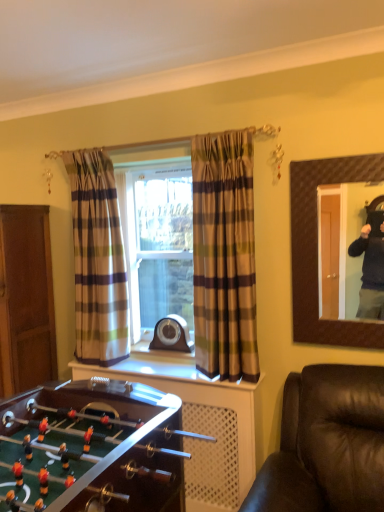
Consider the image. Measure the distance between brown wooden dresser at lower left and camera.

They are 2.23 meters apart.

Identify the location of plaid fabric curtain at left, marked as the first curtain in a left-to-right arrangement. (97, 260).

Locate an element on the screen. The width and height of the screenshot is (384, 512). brown textured mirror at upper right is located at coordinates (317, 249).

Is brown textured mirror at upper right turned away from brown wooden dresser at lower left?

That's not correct — brown textured mirror at upper right is not looking away from brown wooden dresser at lower left.

At what (x,y) coordinates should I click in order to perform the action: click on mirror located above the brown wooden dresser at lower left (from the image's perspective). Please return your answer as a coordinate pair (x, y). Looking at the image, I should click on (317, 249).

Are brown textured mirror at upper right and brown wooden dresser at lower left making contact?

brown textured mirror at upper right and brown wooden dresser at lower left are clearly separated.

Between point (311, 240) and point (195, 426), which one is positioned behind?

Positioned behind is point (195, 426).

Considering the sizes of objects plaid fabric curtain at left, acting as the 1th curtain starting from the back, and brown plaid curtain at center, the first curtain when ordered from front to back, in the image provided, who is smaller, plaid fabric curtain at left, acting as the 1th curtain starting from the back, or brown plaid curtain at center, the first curtain when ordered from front to back,?

With smaller size is brown plaid curtain at center, the first curtain when ordered from front to back.

Which is more to the right, plaid fabric curtain at left, acting as the 2th curtain starting from the right, or brown plaid curtain at center, which appears as the second curtain when viewed from the left?

Positioned to the right is brown plaid curtain at center, which appears as the second curtain when viewed from the left.

Is plaid fabric curtain at left, which is the 2th curtain from front to back, turned away from brown plaid curtain at center, which appears as the second curtain when viewed from the left?

plaid fabric curtain at left, which is the 2th curtain from front to back, is not turned away from brown plaid curtain at center, which appears as the second curtain when viewed from the left.

From the image's perspective, is plaid fabric curtain at left, which is the 2th curtain from front to back, located above or below brown plaid curtain at center, which appears as the second curtain when viewed from the left?

plaid fabric curtain at left, which is the 2th curtain from front to back, is above brown plaid curtain at center, which appears as the second curtain when viewed from the left.

Consider the image. Is brown wooden door at left positioned beyond the bounds of brown wooden dresser at lower left?

brown wooden door at left is positioned outside brown wooden dresser at lower left.

Considering the sizes of brown wooden door at left and brown wooden dresser at lower left in the image, is brown wooden door at left bigger or smaller than brown wooden dresser at lower left?

In the image, brown wooden door at left appears to be smaller than brown wooden dresser at lower left.

Identify the location of dresser that is below the brown wooden door at left (from the image's perspective). The image size is (384, 512). (202, 423).

Which of these two, brown wooden door at left or brown wooden dresser at lower left, stands shorter?

Standing shorter between the two is brown wooden dresser at lower left.

Does point (291, 222) come farther from viewer compared to point (15, 391)?

No, it is in front of (15, 391).

From the picture: Is brown textured mirror at upper right turned away from brown wooden door at left?

No, brown textured mirror at upper right is not facing the opposite direction of brown wooden door at left.

Are brown textured mirror at upper right and brown wooden door at left far apart?

brown textured mirror at upper right is far away from brown wooden door at left.

Can we say brown textured mirror at upper right lies outside brown wooden door at left?

brown textured mirror at upper right lies outside brown wooden door at left's area.

Who is more distant, brown wooden door at left or brown plaid curtain at center, acting as the 1th curtain starting from the right?

brown wooden door at left is more distant.

Where is `the 2nd curtain in front of the brown wooden door at left, starting your count from the anchor`? The width and height of the screenshot is (384, 512). the 2nd curtain in front of the brown wooden door at left, starting your count from the anchor is located at coordinates (224, 256).

Consider the image. From the image's perspective, which is below, brown wooden door at left or brown plaid curtain at center, acting as the 1th curtain starting from the right?

brown wooden door at left.

Visually, is brown wooden door at left positioned to the left or to the right of brown plaid curtain at center, acting as the 1th curtain starting from the right?

brown wooden door at left is to the left of brown plaid curtain at center, acting as the 1th curtain starting from the right.

From the image's perspective, which is above, brown wooden dresser at lower left or brown textured mirror at upper right?

brown textured mirror at upper right appears higher in the image.

Is brown wooden dresser at lower left positioned with its back to brown textured mirror at upper right?

That's not correct — brown wooden dresser at lower left is not looking away from brown textured mirror at upper right.

Considering the positions of objects brown wooden dresser at lower left and brown textured mirror at upper right in the image provided, who is more to the left, brown wooden dresser at lower left or brown textured mirror at upper right?

Positioned to the left is brown wooden dresser at lower left.

Which of these two, brown wooden dresser at lower left or brown textured mirror at upper right, is bigger?

Bigger between the two is brown wooden dresser at lower left.

From a real-world perspective, which object rests below the other?

From a 3D spatial view, brown plaid curtain at center, which appears as the second curtain when viewed from the left, is below.

Can you see brown plaid curtain at center, which appears as the second curtain when viewed from the left, touching brown textured mirror at upper right?

No, brown plaid curtain at center, which appears as the second curtain when viewed from the left, is not beside brown textured mirror at upper right.

Considering the relative positions of brown plaid curtain at center, the first curtain when ordered from front to back, and brown textured mirror at upper right in the image provided, is brown plaid curtain at center, the first curtain when ordered from front to back, behind brown textured mirror at upper right?

Yes, brown plaid curtain at center, the first curtain when ordered from front to back, is further from the viewer.

Where is `dresser that is under the brown textured mirror at upper right (from a real-world perspective)`? dresser that is under the brown textured mirror at upper right (from a real-world perspective) is located at coordinates (202, 423).

Where is `curtain lying below the plaid fabric curtain at left, acting as the 1th curtain starting from the back (from the image's perspective)`? curtain lying below the plaid fabric curtain at left, acting as the 1th curtain starting from the back (from the image's perspective) is located at coordinates (224, 256).

Based on the photo, when comparing their distances from brown textured mirror at upper right, does brown wooden dresser at lower left or brown wooden door at left seem further?

brown wooden door at left is further to brown textured mirror at upper right.

From the image, which object appears to be farther from brown textured mirror at upper right, brown wooden dresser at lower left or plaid fabric curtain at left, acting as the 1th curtain starting from the back?

plaid fabric curtain at left, acting as the 1th curtain starting from the back.

Which object lies nearer to the anchor point brown plaid curtain at center, the 2th curtain positioned from the back, brown textured mirror at upper right or plaid fabric curtain at left, acting as the 1th curtain starting from the back?

brown textured mirror at upper right lies closer to brown plaid curtain at center, the 2th curtain positioned from the back, than the other object.

Looking at the image, which one is located further to brown wooden door at left, brown textured mirror at upper right or brown wooden dresser at lower left?

brown textured mirror at upper right is further to brown wooden door at left.

Looking at the image, which one is located closer to brown textured mirror at upper right, brown wooden door at left or brown plaid curtain at center, which appears as the second curtain when viewed from the left?

The object closer to brown textured mirror at upper right is brown plaid curtain at center, which appears as the second curtain when viewed from the left.

Which object lies nearer to the anchor point brown wooden door at left, brown plaid curtain at center, acting as the 1th curtain starting from the right, or brown textured mirror at upper right?

brown plaid curtain at center, acting as the 1th curtain starting from the right, lies closer to brown wooden door at left than the other object.

Considering their positions, is brown textured mirror at upper right positioned further to plaid fabric curtain at left, acting as the 2th curtain starting from the right, than brown wooden dresser at lower left?

brown textured mirror at upper right lies further to plaid fabric curtain at left, acting as the 2th curtain starting from the right, than the other object.

From the image, which object appears to be farther from brown plaid curtain at center, which appears as the second curtain when viewed from the left, brown wooden door at left or plaid fabric curtain at left, acting as the 2th curtain starting from the right?

brown wooden door at left.

You are a GUI agent. You are given a task and a screenshot of the screen. Output one action in this format:
    pyautogui.click(x=<x>, y=<y>)
    Task: Click on the curtain between brown wooden dresser at lower left and brown textured mirror at upper right
    The height and width of the screenshot is (512, 384).
    Given the screenshot: What is the action you would take?
    pyautogui.click(x=224, y=256)

The image size is (384, 512). What are the coordinates of `dresser between plaid fabric curtain at left, marked as the first curtain in a left-to-right arrangement, and brown textured mirror at upper right, in the horizontal direction` in the screenshot? It's located at pyautogui.click(x=202, y=423).

Image resolution: width=384 pixels, height=512 pixels. In order to click on curtain between plaid fabric curtain at left, acting as the 2th curtain starting from the right, and brown textured mirror at upper right from left to right in this screenshot , I will do `click(224, 256)`.

Locate an element on the screen. The image size is (384, 512). dresser between brown wooden door at left and brown textured mirror at upper right from left to right is located at coordinates (202, 423).